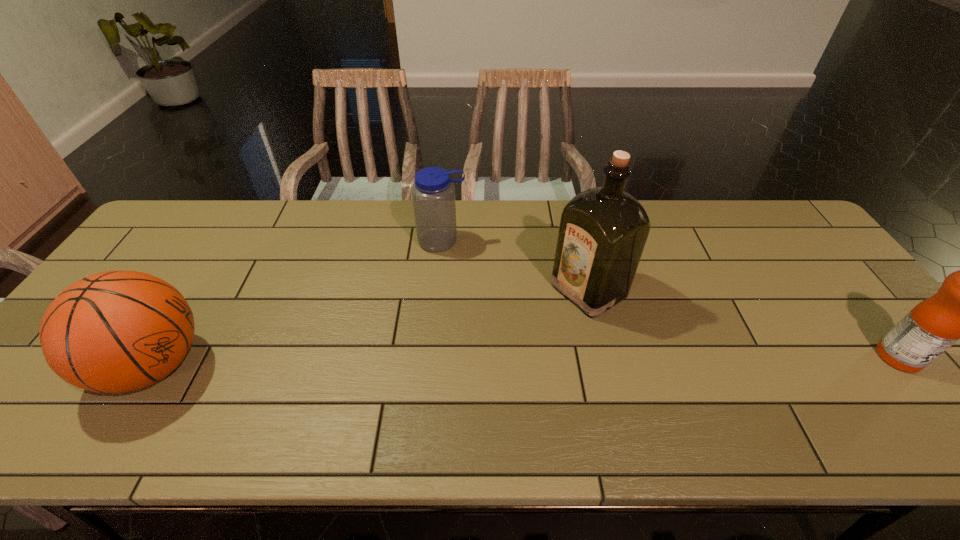
Locate an element on the screen. The width and height of the screenshot is (960, 540). the leftmost object is located at coordinates (118, 331).

The width and height of the screenshot is (960, 540). Find the location of `fruit juice`. fruit juice is located at coordinates (959, 310).

The width and height of the screenshot is (960, 540). Find the location of `the farthest object`. the farthest object is located at coordinates tap(433, 193).

The height and width of the screenshot is (540, 960). I want to click on the third object from right to left, so click(x=433, y=193).

The image size is (960, 540). I want to click on the second object from right to left, so click(x=603, y=230).

Find the location of a particular element. the tallest object is located at coordinates pos(603,230).

Where is `free region located 0.130m on the right of the basketball`? The image size is (960, 540). free region located 0.130m on the right of the basketball is located at coordinates (264, 366).

Where is `vacant space situated with a carrying loop on the side of the farthest object`? vacant space situated with a carrying loop on the side of the farthest object is located at coordinates (452, 329).

You are a GUI agent. You are given a task and a screenshot of the screen. Output one action in this format:
    pyautogui.click(x=<x>, y=<y>)
    Task: Click on the vacant area situated with a carrying loop on the side of the farthest object
    
    Given the screenshot: What is the action you would take?
    pyautogui.click(x=448, y=290)

Locate an element on the screen. The height and width of the screenshot is (540, 960). vacant space located 0.210m with a carrying loop on the side of the farthest object is located at coordinates (x=450, y=306).